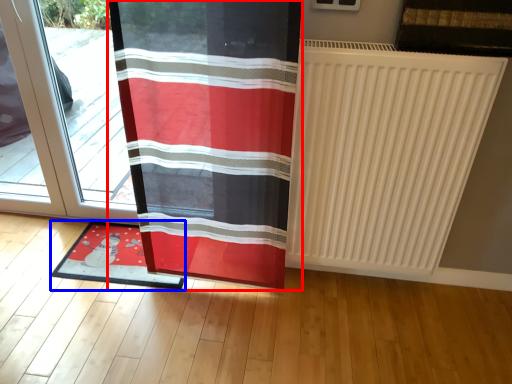
Question: Which point is closer to the camera, curtain (highlighted by a red box) or mat (highlighted by a blue box)?

Choices:
 (A) curtain
 (B) mat

Answer: (A)